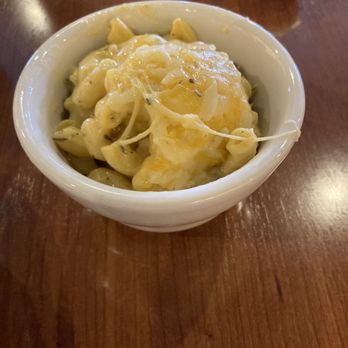
Identify the location of stain on wood. The image size is (348, 348). (280, 295).